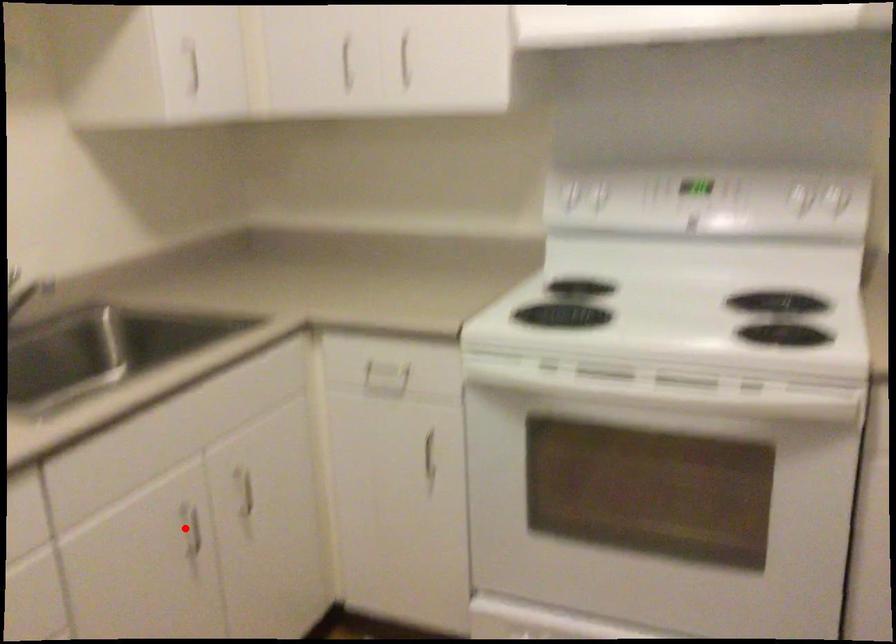
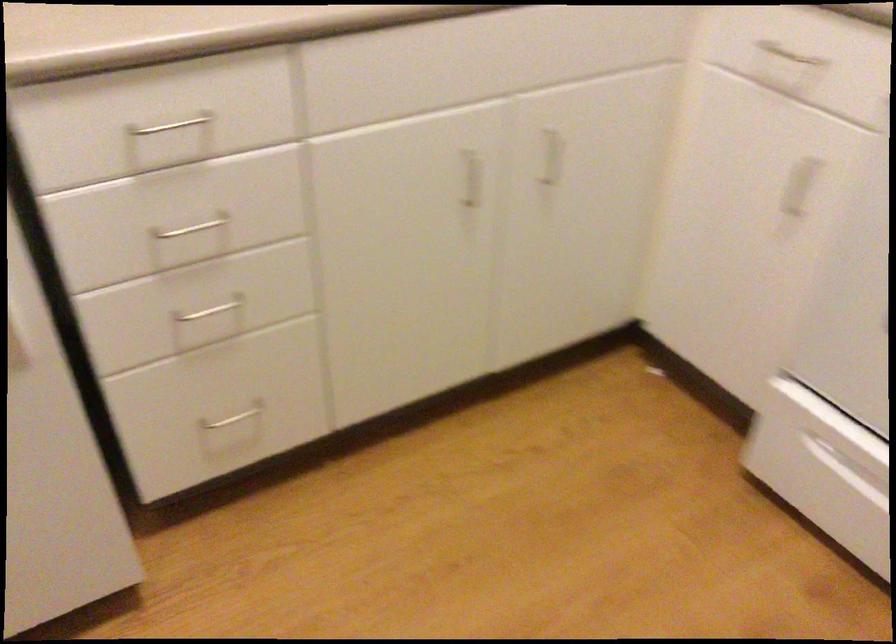
The point at the highlighted location is marked in the first image. Where is the corresponding point in the second image?

(471, 178)